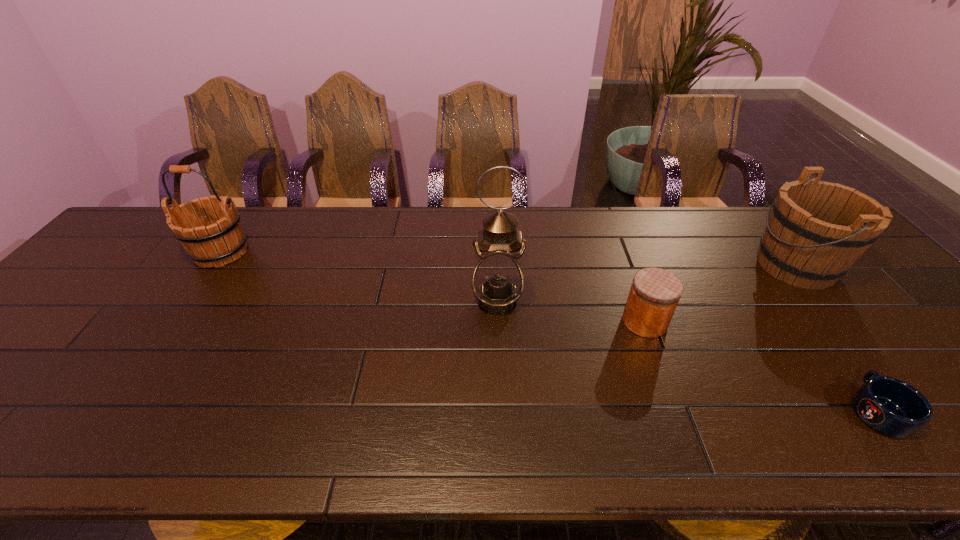
This screenshot has height=540, width=960. I want to click on object that is at the far right corner, so click(817, 230).

The width and height of the screenshot is (960, 540). In the image, there is a desktop. In order to click on free space at the far edge in this screenshot , I will do `click(698, 225)`.

You are a GUI agent. You are given a task and a screenshot of the screen. Output one action in this format:
    pyautogui.click(x=<x>, y=<y>)
    Task: Click on the free region at the left edge of the desktop
    
    Given the screenshot: What is the action you would take?
    pyautogui.click(x=127, y=271)

Find the location of a particular element. The image size is (960, 540). free space at the right edge is located at coordinates (935, 343).

Identify the location of vacant area that lies between the nearest object and the second shortest object. (761, 366).

At what (x,y) coordinates should I click in order to perform the action: click on free space between the left wine bucket and the second shortest object. Please return your answer as a coordinate pair (x, y). Image resolution: width=960 pixels, height=540 pixels. Looking at the image, I should click on (433, 287).

You are a GUI agent. You are given a task and a screenshot of the screen. Output one action in this format:
    pyautogui.click(x=<x>, y=<y>)
    Task: Click on the free spot between the fourth object from right to left and the left wine bucket
    The image size is (960, 540).
    Given the screenshot: What is the action you would take?
    pyautogui.click(x=359, y=276)

Locate an element on the screen. blank region between the third object from right to left and the fourth object from right to left is located at coordinates (571, 311).

Where is `vacant area that lies between the left wine bucket and the jar`? vacant area that lies between the left wine bucket and the jar is located at coordinates (433, 287).

Find the location of a particular element. vacant point located between the left wine bucket and the oil lamp is located at coordinates (359, 276).